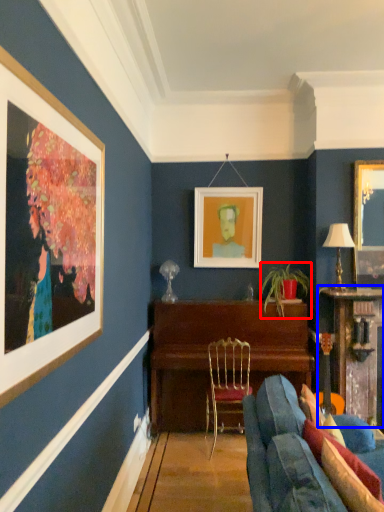
Question: Among these objects, which one is nearest to the camera, houseplant (highlighted by a red box) or table (highlighted by a blue box)?

Choices:
 (A) houseplant
 (B) table

Answer: (B)